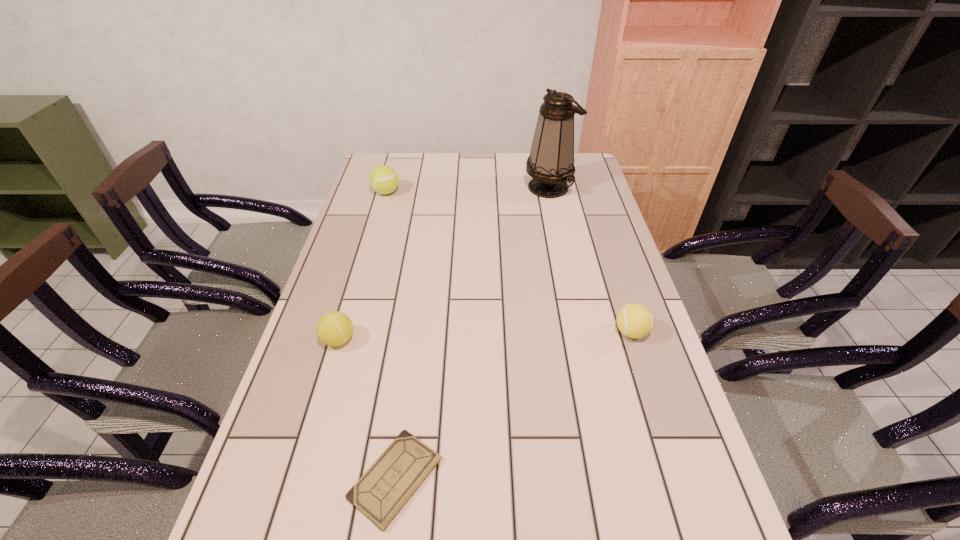
This screenshot has height=540, width=960. Find the location of `vacant area that lies between the third object from right to left and the farthest tennis ball`. vacant area that lies between the third object from right to left and the farthest tennis ball is located at coordinates (391, 335).

Find the location of a particular element. This screenshot has height=540, width=960. vacant point located between the farthest tennis ball and the rightmost tennis ball is located at coordinates (509, 262).

Image resolution: width=960 pixels, height=540 pixels. Find the location of `vacant area that lies between the nearest object and the farthest tennis ball`. vacant area that lies between the nearest object and the farthest tennis ball is located at coordinates (391, 335).

Where is `vacant area between the tallest object and the rightmost tennis ball`? The width and height of the screenshot is (960, 540). vacant area between the tallest object and the rightmost tennis ball is located at coordinates (590, 260).

This screenshot has width=960, height=540. I want to click on unoccupied area between the farthest tennis ball and the shortest object, so click(391, 335).

You are a GUI agent. You are given a task and a screenshot of the screen. Output one action in this format:
    pyautogui.click(x=<x>, y=<y>)
    Task: Click on the free spot between the nearest object and the farthest tennis ball
    
    Given the screenshot: What is the action you would take?
    pyautogui.click(x=391, y=335)

At what (x,y) coordinates should I click in order to perform the action: click on empty location between the farthest tennis ball and the oil lamp. Please return your answer as a coordinate pair (x, y). Image resolution: width=960 pixels, height=540 pixels. Looking at the image, I should click on (468, 190).

The height and width of the screenshot is (540, 960). Find the location of `object that is the fourth closest to the rightmost tennis ball`. object that is the fourth closest to the rightmost tennis ball is located at coordinates (383, 179).

Identify which object is the closest to the rightmost tennis ball. Please provide its 2D coordinates. Your answer should be formatted as a tuple, i.e. [(x, y)], where the tuple contains the x and y coordinates of a point satisfying the conditions above.

[(380, 494)]

At what (x,y) coordinates should I click in order to perform the action: click on tennis ball that stands as the second closest to the third object from left to right. Please return your answer as a coordinate pair (x, y). Looking at the image, I should click on (634, 320).